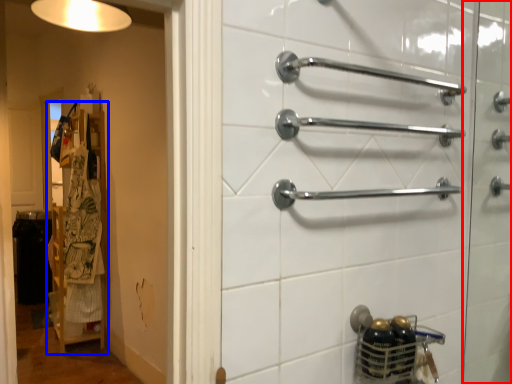
Question: Among these objects, which one is nearest to the camera, screen door (highlighted by a red box) or closet (highlighted by a blue box)?

Choices:
 (A) screen door
 (B) closet

Answer: (A)